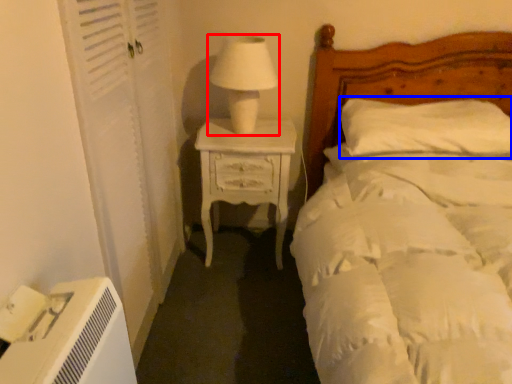
Question: Which of the following is the closest to the observer, table lamp (highlighted by a red box) or pillow (highlighted by a blue box)?

Choices:
 (A) table lamp
 (B) pillow

Answer: (A)